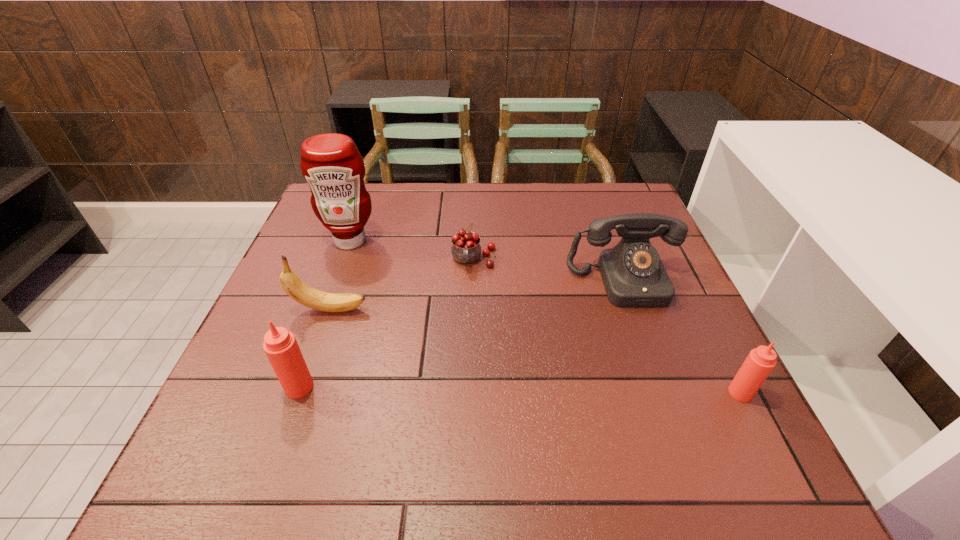
Locate an element on the screen. This screenshot has height=540, width=960. free area in between the banana and the condiment is located at coordinates (341, 275).

At what (x,y) coordinates should I click in order to perform the action: click on vacant space that is in between the banana and the tallest object. Please return your answer as a coordinate pair (x, y). Looking at the image, I should click on (341, 275).

Identify the location of vacant space that is in between the right Tabasco sauce and the tallest object. (545, 317).

This screenshot has width=960, height=540. I want to click on empty space that is in between the third object from right to left and the left Tabasco sauce, so click(387, 323).

Locate an element on the screen. The height and width of the screenshot is (540, 960). free spot between the shortest object and the taller Tabasco sauce is located at coordinates (387, 323).

This screenshot has width=960, height=540. Find the location of `object identified as the fourth closest to the telephone`. object identified as the fourth closest to the telephone is located at coordinates (331, 163).

Locate which object is the second closest to the condiment. Please provide its 2D coordinates. Your answer should be formatted as a tuple, i.e. [(x, y)], where the tuple contains the x and y coordinates of a point satisfying the conditions above.

[(466, 249)]

You are a GUI agent. You are given a task and a screenshot of the screen. Output one action in this format:
    pyautogui.click(x=<x>, y=<y>)
    Task: Click on the blank space that satisfies the following two spatial constraints: 1. on the handle side of the right Tabasco sauce; 2. on the left side of the cherry
    The width and height of the screenshot is (960, 540).
    Given the screenshot: What is the action you would take?
    pyautogui.click(x=471, y=393)

Where is `free spot that satisfies the following two spatial constraints: 1. at the start of the peel on the banana; 2. on the right side of the shorter Tabasco sauce`? free spot that satisfies the following two spatial constraints: 1. at the start of the peel on the banana; 2. on the right side of the shorter Tabasco sauce is located at coordinates (301, 393).

Locate an element on the screen. Image resolution: width=960 pixels, height=540 pixels. free space that satisfies the following two spatial constraints: 1. on the dial of the telephone; 2. on the left side of the right Tabasco sauce is located at coordinates (663, 393).